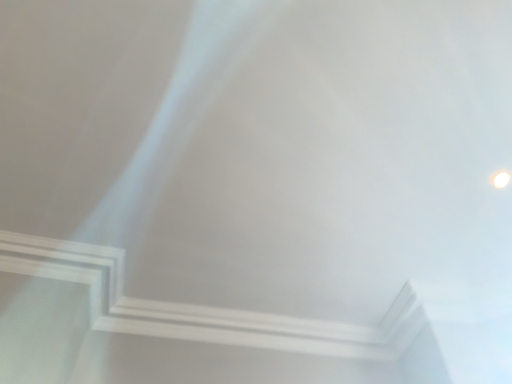
Where is `white matte light at upper right`? Image resolution: width=512 pixels, height=384 pixels. white matte light at upper right is located at coordinates (501, 179).

Measure the distance between point (x=504, y=175) and camera.

1.53 meters.

Describe the element at coordinates (501, 179) in the screenshot. I see `white matte light at upper right` at that location.

Find the location of a particular element. The height and width of the screenshot is (384, 512). white matte light at upper right is located at coordinates (501, 179).